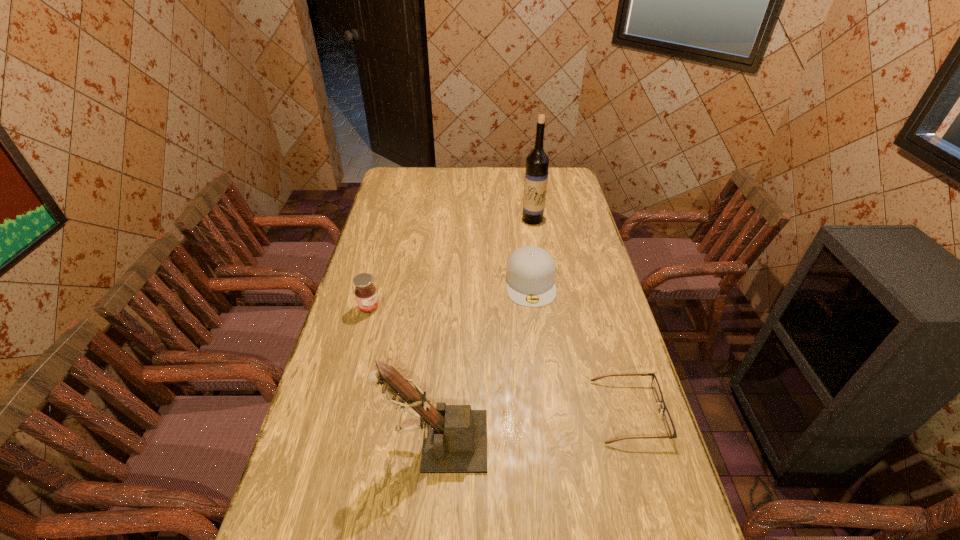
Locate an element on the screen. the second tallest object is located at coordinates (455, 437).

Locate an element on the screen. The image size is (960, 540). figurine is located at coordinates (455, 437).

Where is `the shortest object`? The height and width of the screenshot is (540, 960). the shortest object is located at coordinates (667, 419).

Find the location of `the rightmost object`. the rightmost object is located at coordinates (667, 419).

This screenshot has width=960, height=540. In order to click on jam in this screenshot , I will do `click(365, 292)`.

Locate an element on the screen. the third tallest object is located at coordinates tap(365, 292).

Find the location of a particular element. This screenshot has height=540, width=960. the tallest object is located at coordinates (537, 162).

The width and height of the screenshot is (960, 540). Find the location of `the farthest object`. the farthest object is located at coordinates (537, 162).

This screenshot has height=540, width=960. I want to click on the fourth tallest object, so click(530, 274).

Find the location of a particular element. The image size is (960, 540). free spot located on the front-facing side of the fourth object from right to left is located at coordinates (329, 441).